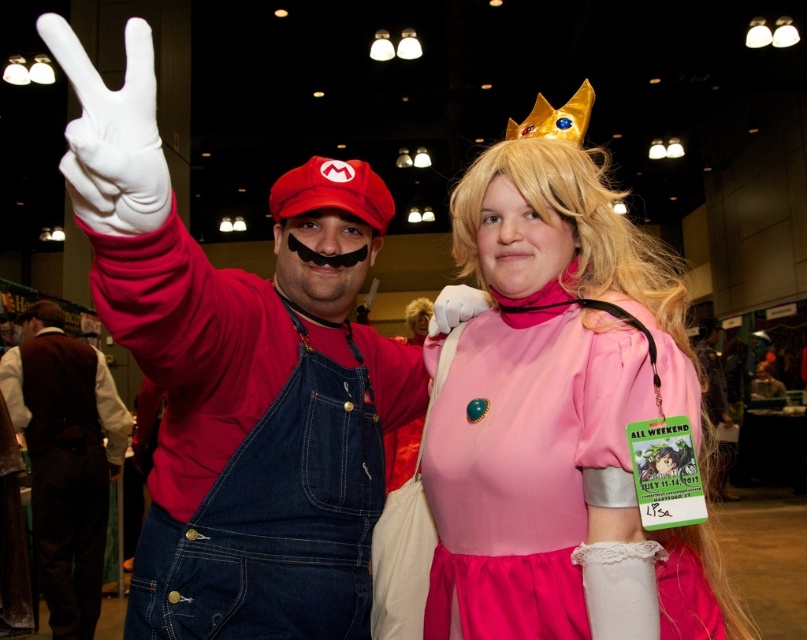
Question: Does denim overalls at center have a smaller size compared to white latex glove at upper left?

Choices:
 (A) no
 (B) yes

Answer: (A)

Question: Which point is closer to the camera?

Choices:
 (A) (78, 422)
 (B) (576, 134)

Answer: (B)

Question: Is pink satin dress at center bigger than white latex glove at upper left?

Choices:
 (A) no
 (B) yes

Answer: (B)

Question: Does denim overalls at center come behind white matte glove at upper center?

Choices:
 (A) no
 (B) yes

Answer: (B)

Question: Which point is farther to the camera?

Choices:
 (A) (558, 122)
 (B) (99, 394)
 (C) (587, 268)

Answer: (B)

Question: Which point is closer to the camera?

Choices:
 (A) white latex glove at upper left
 (B) gold metallic crown at upper center

Answer: (A)